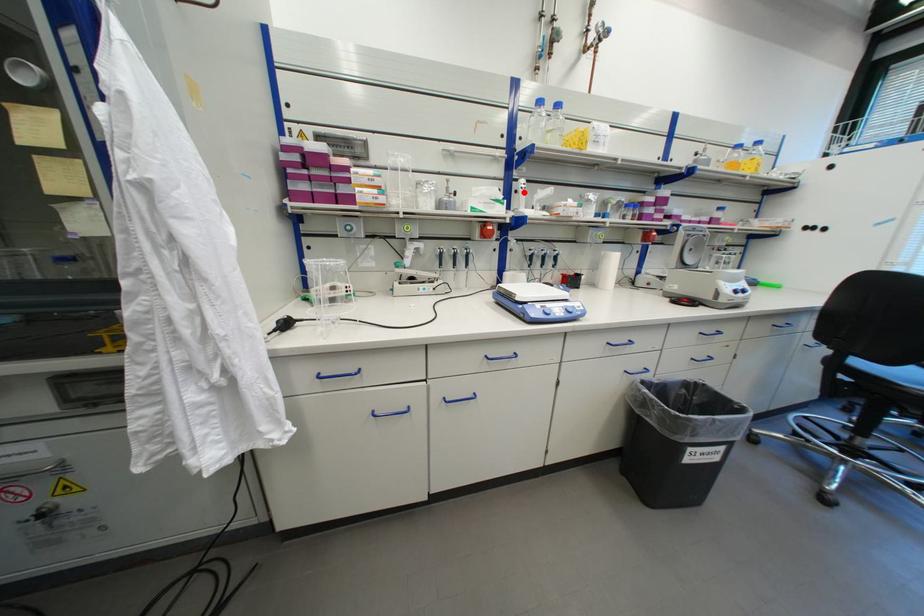
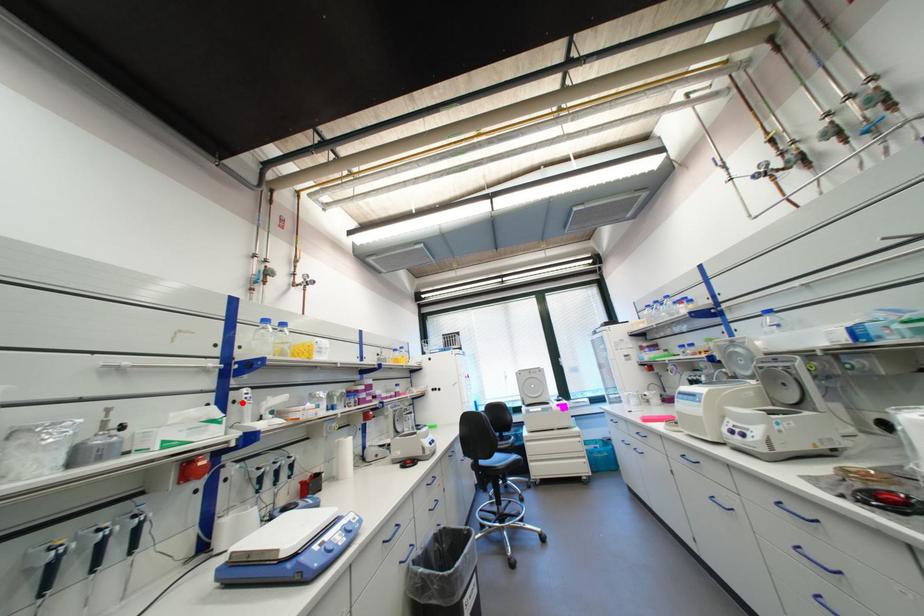
I am providing you with two images of the same scene from different viewpoints. A red point is marked on the first image and another point is marked on the second image. Is the marked point in image1 the same physical position as the marked point in image2?

Yes